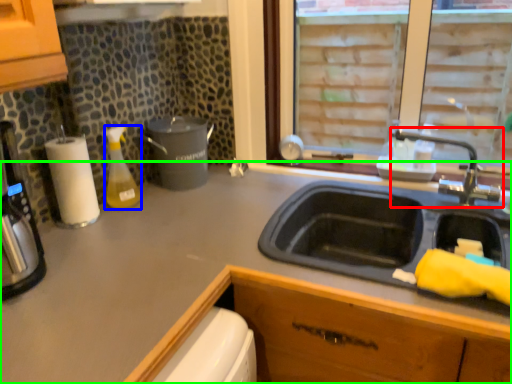
Question: Which object is positioned farthest from tap (highlighted by a red box)? Select from bottle (highlighted by a blue box) and countertop (highlighted by a green box).

Choices:
 (A) bottle
 (B) countertop

Answer: (A)